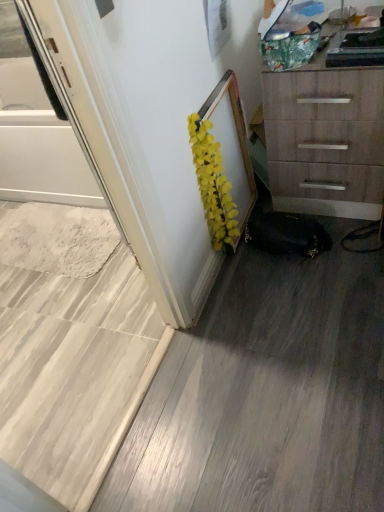
Question: From the image's perspective, does white glossy screen door at left appear lower than wooden chest of drawers at upper right?

Choices:
 (A) no
 (B) yes

Answer: (B)

Question: Is white glossy screen door at left at the right side of wooden chest of drawers at upper right?

Choices:
 (A) yes
 (B) no

Answer: (B)

Question: Can you confirm if white glossy screen door at left is bigger than wooden chest of drawers at upper right?

Choices:
 (A) no
 (B) yes

Answer: (A)

Question: Considering the relative sizes of white glossy screen door at left and wooden chest of drawers at upper right in the image provided, is white glossy screen door at left taller than wooden chest of drawers at upper right?

Choices:
 (A) yes
 (B) no

Answer: (B)

Question: Does white glossy screen door at left come in front of wooden chest of drawers at upper right?

Choices:
 (A) no
 (B) yes

Answer: (B)

Question: From a real-world perspective, is white glossy screen door at left located beneath wooden chest of drawers at upper right?

Choices:
 (A) no
 (B) yes

Answer: (A)

Question: Can you confirm if wooden chest of drawers at upper right is smaller than yellow artificial flowers at center?

Choices:
 (A) no
 (B) yes

Answer: (A)

Question: From the image's perspective, does wooden chest of drawers at upper right appear lower than yellow artificial flowers at center?

Choices:
 (A) yes
 (B) no

Answer: (B)

Question: From the image's perspective, is wooden chest of drawers at upper right located above yellow artificial flowers at center?

Choices:
 (A) yes
 (B) no

Answer: (A)

Question: Is wooden chest of drawers at upper right surrounding yellow artificial flowers at center?

Choices:
 (A) no
 (B) yes

Answer: (A)

Question: Considering the relative sizes of wooden chest of drawers at upper right and yellow artificial flowers at center in the image provided, is wooden chest of drawers at upper right shorter than yellow artificial flowers at center?

Choices:
 (A) yes
 (B) no

Answer: (B)

Question: Is wooden chest of drawers at upper right outside yellow artificial flowers at center?

Choices:
 (A) no
 (B) yes

Answer: (B)

Question: Would you consider white glossy screen door at left to be distant from yellow artificial flowers at center?

Choices:
 (A) no
 (B) yes

Answer: (A)